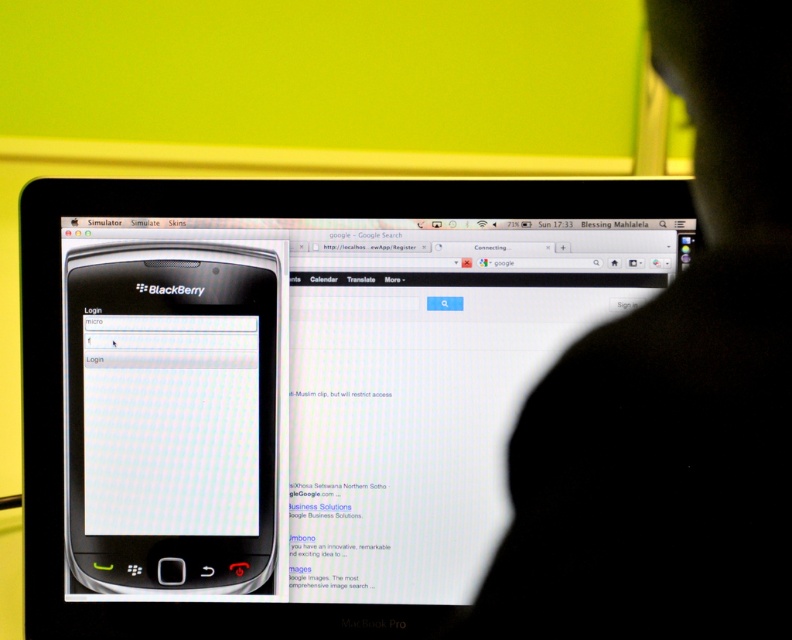
Question: Is black matte silhouette at center smaller than white glossy blackberry at center-left?

Choices:
 (A) no
 (B) yes

Answer: (A)

Question: Does black matte silhouette at center appear on the right side of white glossy blackberry at center-left?

Choices:
 (A) no
 (B) yes

Answer: (B)

Question: Does black matte silhouette at center have a greater width compared to white glossy blackberry at center-left?

Choices:
 (A) yes
 (B) no

Answer: (B)